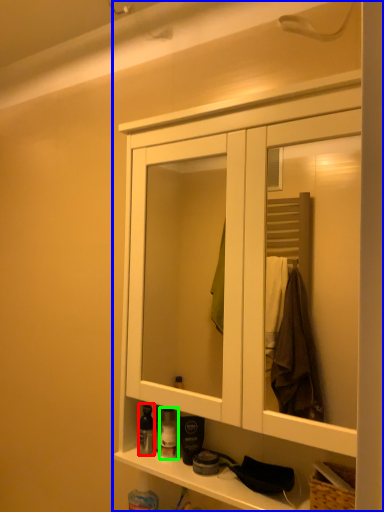
Question: Estimate the real-world distances between objects in this image. Which object is closer to toiletry (highlighted by a red box), cabinetry (highlighted by a blue box) or toiletry (highlighted by a green box)?

Choices:
 (A) cabinetry
 (B) toiletry

Answer: (B)